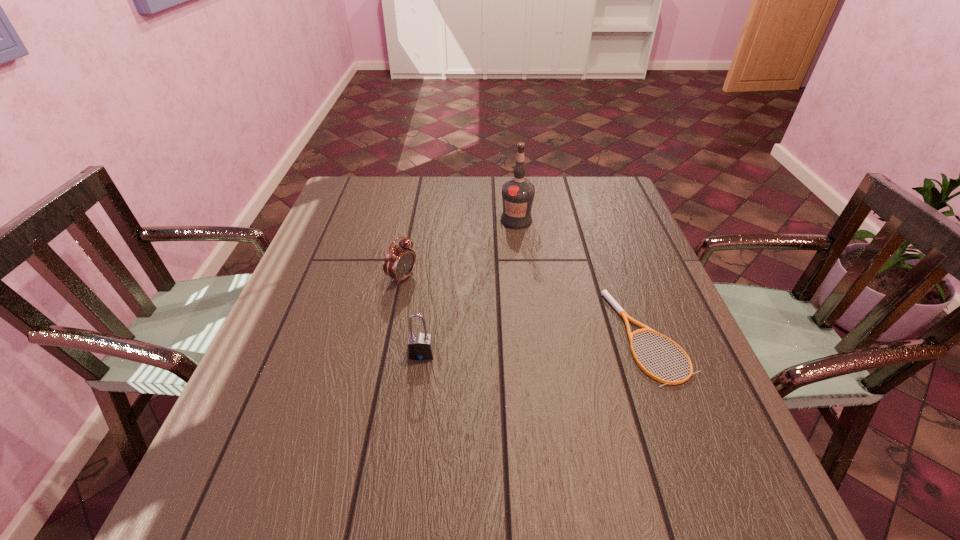
The height and width of the screenshot is (540, 960). I want to click on vacant space situated 0.120m on the front label of the tallest object, so click(x=529, y=255).

Locate an element on the screen. vacant area situated 0.200m on the front label of the tallest object is located at coordinates (536, 274).

At what (x,y) coordinates should I click in order to perform the action: click on vacant space located on the face of the alarm clock. Please return your answer as a coordinate pair (x, y). The width and height of the screenshot is (960, 540). Looking at the image, I should click on (444, 300).

This screenshot has width=960, height=540. I want to click on free region located on the face of the alarm clock, so click(x=524, y=340).

Image resolution: width=960 pixels, height=540 pixels. In order to click on free space located 0.380m on the face of the alarm clock in this screenshot , I will do `click(549, 352)`.

This screenshot has width=960, height=540. In order to click on object situated at the far edge in this screenshot , I will do `click(518, 193)`.

Locate an element on the screen. object that is at the right edge is located at coordinates (610, 299).

Where is `free location at the far edge of the desktop`? Image resolution: width=960 pixels, height=540 pixels. free location at the far edge of the desktop is located at coordinates (562, 198).

In the image, there is a desktop. At what (x,y) coordinates should I click in order to perform the action: click on blank space at the near edge. Please return your answer as a coordinate pair (x, y). Looking at the image, I should click on (478, 414).

Identify the location of vacant space at the left edge of the desktop. This screenshot has height=540, width=960. (323, 300).